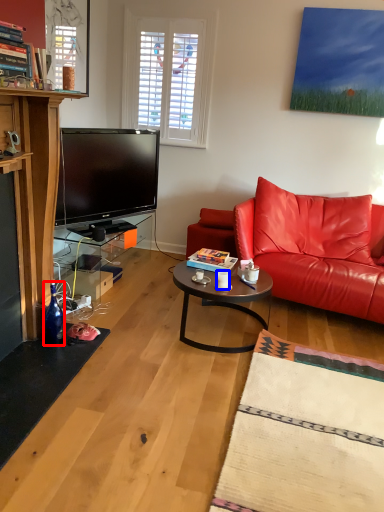
Question: Among these objects, which one is nearest to the camera, bottle (highlighted by a red box) or coffee cup (highlighted by a blue box)?

Choices:
 (A) bottle
 (B) coffee cup

Answer: (A)